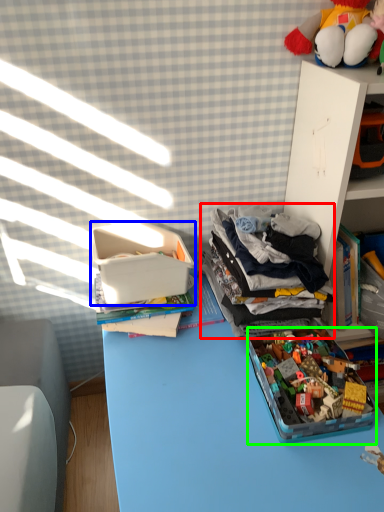
Question: Which is nearer to the clothing (highlighted by a red box)? storage box (highlighted by a blue box) or toy (highlighted by a green box).

Choices:
 (A) storage box
 (B) toy

Answer: (B)